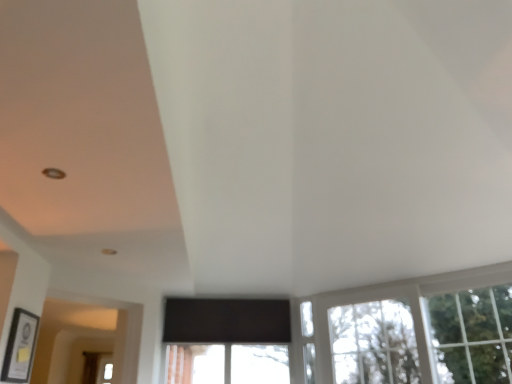
Question: Are matte black picture frame at lower left and clear glass window at lower right making contact?

Choices:
 (A) no
 (B) yes

Answer: (A)

Question: Is matte black picture frame at lower left not close to clear glass window at lower right?

Choices:
 (A) yes
 (B) no

Answer: (A)

Question: Is matte black picture frame at lower left outside clear glass window at lower right?

Choices:
 (A) no
 (B) yes

Answer: (B)

Question: Does matte black picture frame at lower left have a lesser height compared to clear glass window at lower right?

Choices:
 (A) no
 (B) yes

Answer: (B)

Question: From a real-world perspective, is matte black picture frame at lower left physically above clear glass window at lower right?

Choices:
 (A) yes
 (B) no

Answer: (B)

Question: Does matte black picture frame at lower left lie behind clear glass window at lower right?

Choices:
 (A) yes
 (B) no

Answer: (B)

Question: Is the position of clear glass window at lower right more distant than that of matte black picture frame at lower left?

Choices:
 (A) no
 (B) yes

Answer: (B)

Question: Can you confirm if clear glass window at lower right is wider than matte black picture frame at lower left?

Choices:
 (A) yes
 (B) no

Answer: (A)

Question: Considering the relative sizes of clear glass window at lower right and matte black picture frame at lower left in the image provided, is clear glass window at lower right bigger than matte black picture frame at lower left?

Choices:
 (A) no
 (B) yes

Answer: (B)

Question: Is the position of clear glass window at lower right less distant than that of matte black picture frame at lower left?

Choices:
 (A) no
 (B) yes

Answer: (A)

Question: Does clear glass window at lower right contain matte black picture frame at lower left?

Choices:
 (A) no
 (B) yes

Answer: (A)

Question: Considering the relative sizes of clear glass window at lower right and matte black picture frame at lower left in the image provided, is clear glass window at lower right smaller than matte black picture frame at lower left?

Choices:
 (A) yes
 (B) no

Answer: (B)

Question: Does green leafy tree at upper right turn towards clear glass window at lower right?

Choices:
 (A) yes
 (B) no

Answer: (A)